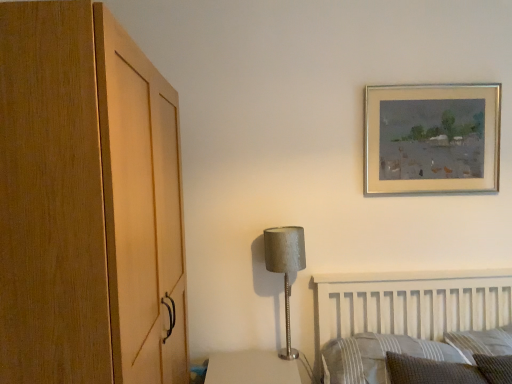
What do you see at coordinates (285, 268) in the screenshot?
I see `satin silver lamp at center` at bounding box center [285, 268].

How much space does textured gray pillow at lower right, the 3th pillow in the left-to-right sequence, occupy vertically?

9.07 inches.

Locate an element on the screen. This screenshot has width=512, height=384. gold metallic picture frame at upper right is located at coordinates (432, 139).

What is the approximate width of gold metallic picture frame at upper right?

gold metallic picture frame at upper right is 1.36 inches in width.

Locate an element on the screen. satin silver lamp at center is located at coordinates (285, 268).

Is textured gray pillow at lower right, the 1th pillow positioned from the right, far away from satin silver lamp at center?

textured gray pillow at lower right, the 1th pillow positioned from the right, is near satin silver lamp at center, not far away.

From the image's perspective, is textured gray pillow at lower right, the 1th pillow positioned from the right, on satin silver lamp at center?

No, from the image's perspective, textured gray pillow at lower right, the 1th pillow positioned from the right, is not above satin silver lamp at center.

Considering the points (475, 349) and (289, 315), which point is in front, point (475, 349) or point (289, 315)?

Positioned in front is point (475, 349).

Considering the sizes of objects textured gray pillow at lower right, the 1th pillow positioned from the right, and satin silver lamp at center in the image provided, who is bigger, textured gray pillow at lower right, the 1th pillow positioned from the right, or satin silver lamp at center?

textured gray pillow at lower right, the 1th pillow positioned from the right, is bigger.

Locate an element on the screen. The width and height of the screenshot is (512, 384). picture frame behind the striped fabric pillow at lower right, positioned as the first pillow in left-to-right order is located at coordinates (432, 139).

Which object is further away from the camera, gold metallic picture frame at upper right or striped fabric pillow at lower right, the 3th pillow from the right?

gold metallic picture frame at upper right is further away from the camera.

From the picture: Looking at their sizes, would you say gold metallic picture frame at upper right is wider or thinner than striped fabric pillow at lower right, the 3th pillow from the right?

Clearly, gold metallic picture frame at upper right has less width compared to striped fabric pillow at lower right, the 3th pillow from the right.

Looking at this image, from a real-world perspective, which object rests below the other?

From a 3D spatial view, striped fabric pillow at lower right, the 3th pillow from the right, is below.

Would you say striped fabric pillow at lower right, positioned as the first pillow in left-to-right order, contains satin silver lamp at center?

No, satin silver lamp at center is located outside of striped fabric pillow at lower right, positioned as the first pillow in left-to-right order.

Based on the photo, from a real-world perspective, is striped fabric pillow at lower right, positioned as the first pillow in left-to-right order, below satin silver lamp at center?

Indeed, from a real-world perspective, striped fabric pillow at lower right, positioned as the first pillow in left-to-right order, is positioned beneath satin silver lamp at center.

How much distance is there between striped fabric pillow at lower right, the 3th pillow from the right, and satin silver lamp at center?

striped fabric pillow at lower right, the 3th pillow from the right, and satin silver lamp at center are 16.86 inches apart from each other.

Based on their sizes in the image, would you say striped fabric pillow at lower right, positioned as the first pillow in left-to-right order, is bigger or smaller than satin silver lamp at center?

Considering their sizes, striped fabric pillow at lower right, positioned as the first pillow in left-to-right order, takes up more space than satin silver lamp at center.

From a real-world perspective, which is physically above, woven fabric pillow at lower right, placed as the 2th pillow when sorted from left to right, or satin silver lamp at center?

From a 3D spatial view, satin silver lamp at center is above.

Between woven fabric pillow at lower right, positioned as the 2th pillow in right-to-left order, and satin silver lamp at center, which one has smaller width?

satin silver lamp at center is thinner.

Is woven fabric pillow at lower right, positioned as the 2th pillow in right-to-left order, aimed at satin silver lamp at center?

No, woven fabric pillow at lower right, positioned as the 2th pillow in right-to-left order, is not oriented towards satin silver lamp at center.

Are satin silver lamp at center and woven fabric pillow at lower right, positioned as the 2th pillow in right-to-left order, beside each other?

No, satin silver lamp at center is not touching woven fabric pillow at lower right, positioned as the 2th pillow in right-to-left order.

Would you say satin silver lamp at center is inside or outside woven fabric pillow at lower right, positioned as the 2th pillow in right-to-left order?

satin silver lamp at center cannot be found inside woven fabric pillow at lower right, positioned as the 2th pillow in right-to-left order.

Which pillow is the 2nd one when counting from the right side of the satin silver lamp at center? Please provide its 2D coordinates.

[(430, 371)]

Could you tell me if satin silver lamp at center is turned towards woven fabric pillow at lower right, placed as the 2th pillow when sorted from left to right?

No, satin silver lamp at center is not aimed at woven fabric pillow at lower right, placed as the 2th pillow when sorted from left to right.

Considering the relative positions of striped fabric pillow at lower right, positioned as the first pillow in left-to-right order, and woven fabric pillow at lower right, positioned as the 2th pillow in right-to-left order, in the image provided, is striped fabric pillow at lower right, positioned as the first pillow in left-to-right order, to the left of woven fabric pillow at lower right, positioned as the 2th pillow in right-to-left order, from the viewer's perspective?

Correct, you'll find striped fabric pillow at lower right, positioned as the first pillow in left-to-right order, to the left of woven fabric pillow at lower right, positioned as the 2th pillow in right-to-left order.

Is striped fabric pillow at lower right, the 3th pillow from the right, further to camera compared to woven fabric pillow at lower right, positioned as the 2th pillow in right-to-left order?

Yes, it is behind woven fabric pillow at lower right, positioned as the 2th pillow in right-to-left order.

Would you say striped fabric pillow at lower right, the 3th pillow from the right, is inside or outside woven fabric pillow at lower right, placed as the 2th pillow when sorted from left to right?

striped fabric pillow at lower right, the 3th pillow from the right, lies outside woven fabric pillow at lower right, placed as the 2th pillow when sorted from left to right.

Can you confirm if striped fabric pillow at lower right, positioned as the first pillow in left-to-right order, is thinner than woven fabric pillow at lower right, positioned as the 2th pillow in right-to-left order?

Incorrect, the width of striped fabric pillow at lower right, positioned as the first pillow in left-to-right order, is not less than that of woven fabric pillow at lower right, positioned as the 2th pillow in right-to-left order.

Which point is more distant from viewer, (287,277) or (439,128)?

Positioned behind is point (439,128).

Considering the sizes of objects satin silver lamp at center and gold metallic picture frame at upper right in the image provided, who is taller, satin silver lamp at center or gold metallic picture frame at upper right?

satin silver lamp at center.

In the image, is satin silver lamp at center on the left side or the right side of gold metallic picture frame at upper right?

In the image, satin silver lamp at center appears on the left side of gold metallic picture frame at upper right.

Considering the sizes of objects satin silver lamp at center and gold metallic picture frame at upper right in the image provided, who is smaller, satin silver lamp at center or gold metallic picture frame at upper right?

Smaller between the two is gold metallic picture frame at upper right.

From the satin silver lamp at center, count 3rd pillow to the right and point to it. Please provide its 2D coordinates.

[(482, 342)]

From the image's perspective, count 3rd pillows downward from the gold metallic picture frame at upper right and point to it. Please provide its 2D coordinates.

[(378, 356)]

Based on the photo, from the image, which object appears to be nearer to textured gray pillow at lower right, the 3th pillow in the left-to-right sequence, satin silver lamp at center or gold metallic picture frame at upper right?

The object closer to textured gray pillow at lower right, the 3th pillow in the left-to-right sequence, is satin silver lamp at center.

Based on their spatial positions, is striped fabric pillow at lower right, the 3th pillow from the right, or satin silver lamp at center further from gold metallic picture frame at upper right?

striped fabric pillow at lower right, the 3th pillow from the right, is positioned further to the anchor gold metallic picture frame at upper right.

Looking at the image, which one is located closer to satin silver lamp at center, textured gray pillow at lower right, the 3th pillow in the left-to-right sequence, or striped fabric pillow at lower right, the 3th pillow from the right?

Based on the image, striped fabric pillow at lower right, the 3th pillow from the right, appears to be nearer to satin silver lamp at center.

Estimate the real-world distances between objects in this image. Which object is closer to textured gray pillow at lower right, the 3th pillow in the left-to-right sequence, striped fabric pillow at lower right, positioned as the first pillow in left-to-right order, or satin silver lamp at center?

striped fabric pillow at lower right, positioned as the first pillow in left-to-right order, is closer to textured gray pillow at lower right, the 3th pillow in the left-to-right sequence.

Considering their positions, is textured gray pillow at lower right, the 1th pillow positioned from the right, positioned further to striped fabric pillow at lower right, the 3th pillow from the right, than gold metallic picture frame at upper right?

gold metallic picture frame at upper right is further to striped fabric pillow at lower right, the 3th pillow from the right.

Looking at the image, which one is located closer to satin silver lamp at center, woven fabric pillow at lower right, positioned as the 2th pillow in right-to-left order, or gold metallic picture frame at upper right?

Answer: woven fabric pillow at lower right, positioned as the 2th pillow in right-to-left order.

Based on the photo, based on their spatial positions, is gold metallic picture frame at upper right or textured gray pillow at lower right, the 3th pillow in the left-to-right sequence, closer to satin silver lamp at center?

Based on the image, gold metallic picture frame at upper right appears to be nearer to satin silver lamp at center.

Which object lies nearer to the anchor point woven fabric pillow at lower right, placed as the 2th pillow when sorted from left to right, striped fabric pillow at lower right, positioned as the first pillow in left-to-right order, or gold metallic picture frame at upper right?

striped fabric pillow at lower right, positioned as the first pillow in left-to-right order, is closer to woven fabric pillow at lower right, placed as the 2th pillow when sorted from left to right.

Where is `pillow between satin silver lamp at center and woven fabric pillow at lower right, placed as the 2th pillow when sorted from left to right`? The height and width of the screenshot is (384, 512). pillow between satin silver lamp at center and woven fabric pillow at lower right, placed as the 2th pillow when sorted from left to right is located at coordinates (378, 356).

You are a GUI agent. You are given a task and a screenshot of the screen. Output one action in this format:
    pyautogui.click(x=<x>, y=<y>)
    Task: Click on the table lamp between gold metallic picture frame at upper right and textured gray pillow at lower right, the 1th pillow positioned from the right, from top to bottom
    
    Given the screenshot: What is the action you would take?
    pyautogui.click(x=285, y=268)

The width and height of the screenshot is (512, 384). What are the coordinates of `table lamp that lies between gold metallic picture frame at upper right and striped fabric pillow at lower right, the 3th pillow from the right, from top to bottom` in the screenshot? It's located at (285, 268).

Find the location of a particular element. This screenshot has width=512, height=384. pillow located between striped fabric pillow at lower right, positioned as the first pillow in left-to-right order, and textured gray pillow at lower right, the 3th pillow in the left-to-right sequence, in the left-right direction is located at coordinates (430, 371).